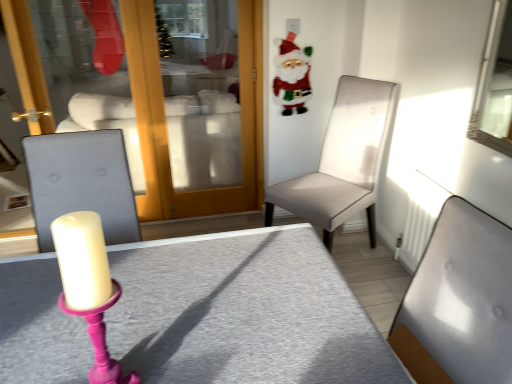
Question: From a real-world perspective, is gray fabric table at center positioned under light beige fabric chair at center right, which is the second chair from front to back, based on gravity?

Choices:
 (A) no
 (B) yes

Answer: (B)

Question: Can you confirm if gray fabric table at center is thinner than light beige fabric chair at center right, which is the 1th chair in back-to-front order?

Choices:
 (A) no
 (B) yes

Answer: (A)

Question: From the image's perspective, is gray fabric table at center under light beige fabric chair at center right, which is the second chair from front to back?

Choices:
 (A) no
 (B) yes

Answer: (B)

Question: Does gray fabric table at center have a greater width compared to light beige fabric chair at center right, which is the second chair from front to back?

Choices:
 (A) no
 (B) yes

Answer: (B)

Question: Does gray fabric table at center have a smaller size compared to light beige fabric chair at center right, which is the second chair from front to back?

Choices:
 (A) yes
 (B) no

Answer: (B)

Question: Considering the positions of light gray fabric chair at center, which is counted as the second chair, starting from the back, and felt santa claus at upper right in the image, is light gray fabric chair at center, which is counted as the second chair, starting from the back, wider or thinner than felt santa claus at upper right?

Choices:
 (A) wide
 (B) thin

Answer: (A)

Question: Considering the positions of light gray fabric chair at center, which is counted as the second chair, starting from the back, and felt santa claus at upper right in the image, is light gray fabric chair at center, which is counted as the second chair, starting from the back, taller or shorter than felt santa claus at upper right?

Choices:
 (A) short
 (B) tall

Answer: (B)

Question: Is light gray fabric chair at center, the first chair when ordered from front to back, bigger or smaller than felt santa claus at upper right?

Choices:
 (A) big
 (B) small

Answer: (A)

Question: Considering the relative positions of light gray fabric chair at center, the first chair when ordered from front to back, and felt santa claus at upper right in the image provided, is light gray fabric chair at center, the first chair when ordered from front to back, to the left or to the right of felt santa claus at upper right?

Choices:
 (A) right
 (B) left

Answer: (A)

Question: From a real-world perspective, is light beige fabric chair at center right, which is the 1th chair in back-to-front order, above or below gray fabric table at center?

Choices:
 (A) below
 (B) above

Answer: (B)

Question: In the image, is light beige fabric chair at center right, which is the second chair from front to back, on the left side or the right side of gray fabric table at center?

Choices:
 (A) left
 (B) right

Answer: (B)

Question: From the image's perspective, relative to gray fabric table at center, is light beige fabric chair at center right, which is the second chair from front to back, above or below?

Choices:
 (A) below
 (B) above

Answer: (B)

Question: Considering the positions of point (326, 188) and point (307, 279), is point (326, 188) closer or farther from the camera than point (307, 279)?

Choices:
 (A) farther
 (B) closer

Answer: (A)

Question: In terms of width, does gray fabric table at center look wider or thinner when compared to light beige fabric chair at center right, which is the 1th chair in back-to-front order?

Choices:
 (A) wide
 (B) thin

Answer: (A)

Question: Relative to light beige fabric chair at center right, which is the 1th chair in back-to-front order, is gray fabric table at center in front or behind?

Choices:
 (A) front
 (B) behind

Answer: (A)